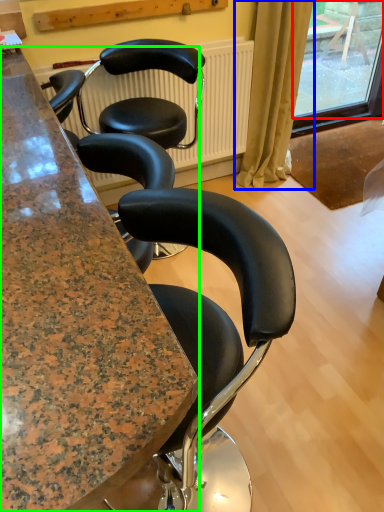
Question: Which object is positioned farthest from window screen (highlighted by a red box)? Select from curtain (highlighted by a blue box) and cabinetry (highlighted by a green box).

Choices:
 (A) curtain
 (B) cabinetry

Answer: (B)